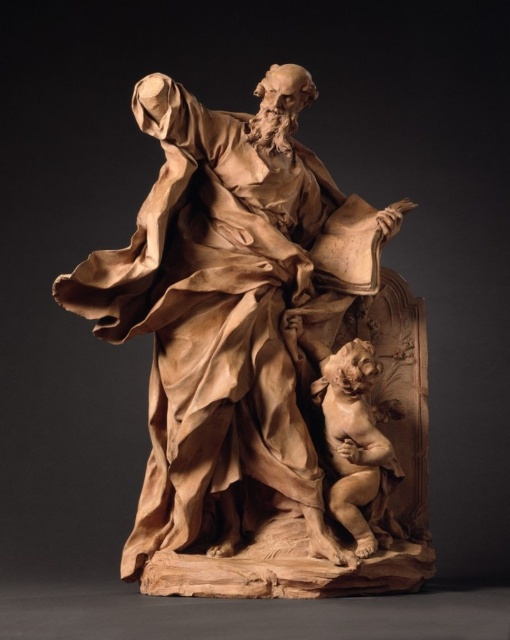
You are an art restorer working on the wooden sculpture. You need to clean the wooden statue at center and the smooth beige cherub at lower right. Which object should you clean first if you want to start with the one that is above the other?

The wooden statue at center should be cleaned first because it is positioned over the smooth beige cherub at lower right, meaning it is above the other.

You are an art conservator tasked with moving the wooden statue at center and the smooth beige cherub at lower right to a new exhibition space. Your transport crate has a width of 10 centimeters. Can both items fit side by side without overlapping?

The distance between wooden statue at center and smooth beige cherub at lower right is 9.85 centimeters, which is less than the crate width of 10 centimeters. Therefore, both items can fit side by side within the crate without overlapping.

You are an art conservator examining the sculpture. You need to clean both the wooden statue at center and the smooth beige cherub at lower right. Which one should you start with if you want to work on the part closest to you first?

You should start with the wooden statue at center because it is closer to the viewer than the smooth beige cherub at lower right.